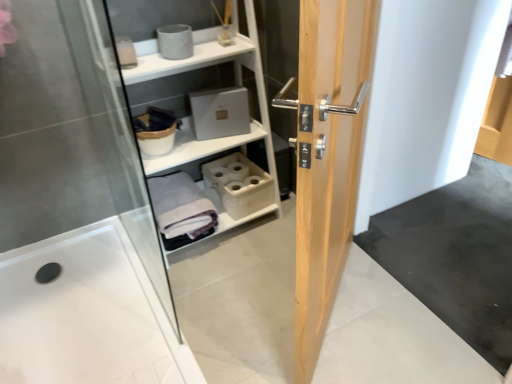
Question: Does transparent glass shower door at left have a greater width compared to light wood door at center?

Choices:
 (A) no
 (B) yes

Answer: (B)

Question: Is transparent glass shower door at left shorter than light wood door at center?

Choices:
 (A) no
 (B) yes

Answer: (B)

Question: Is transparent glass shower door at left bigger than light wood door at center?

Choices:
 (A) no
 (B) yes

Answer: (A)

Question: Is transparent glass shower door at left positioned far away from light wood door at center?

Choices:
 (A) no
 (B) yes

Answer: (B)

Question: Is transparent glass shower door at left in front of light wood door at center?

Choices:
 (A) no
 (B) yes

Answer: (A)

Question: Is transparent glass shower door at left looking in the opposite direction of light wood door at center?

Choices:
 (A) no
 (B) yes

Answer: (A)

Question: Could you tell me if white glossy bath at lower left is facing transparent glass shower door at left?

Choices:
 (A) no
 (B) yes

Answer: (A)

Question: From the image's perspective, is white glossy bath at lower left on top of transparent glass shower door at left?

Choices:
 (A) no
 (B) yes

Answer: (A)

Question: Is white glossy bath at lower left to the left of transparent glass shower door at left from the viewer's perspective?

Choices:
 (A) no
 (B) yes

Answer: (B)

Question: Is transparent glass shower door at left located within white glossy bath at lower left?

Choices:
 (A) yes
 (B) no

Answer: (B)

Question: Does white glossy bath at lower left have a smaller size compared to transparent glass shower door at left?

Choices:
 (A) yes
 (B) no

Answer: (A)

Question: From a real-world perspective, is white glossy bath at lower left under transparent glass shower door at left?

Choices:
 (A) no
 (B) yes

Answer: (B)

Question: Considering the relative sizes of white matte shelf at upper center and light wood door at center in the image provided, is white matte shelf at upper center thinner than light wood door at center?

Choices:
 (A) yes
 (B) no

Answer: (B)